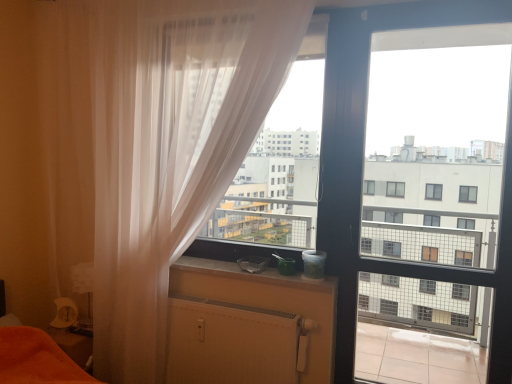
Question: Is white matte radiator at lower center looking in the opposite direction of smooth concrete window sill at center?

Choices:
 (A) no
 (B) yes

Answer: (A)

Question: Does white matte radiator at lower center have a lesser width compared to smooth concrete window sill at center?

Choices:
 (A) yes
 (B) no

Answer: (A)

Question: Is white matte radiator at lower center far from smooth concrete window sill at center?

Choices:
 (A) yes
 (B) no

Answer: (B)

Question: Is white matte radiator at lower center not within smooth concrete window sill at center?

Choices:
 (A) no
 (B) yes

Answer: (B)

Question: From a real-world perspective, is white matte radiator at lower center located higher than smooth concrete window sill at center?

Choices:
 (A) no
 (B) yes

Answer: (A)

Question: Considering the positions of white matte radiator at lower center and transparent plastic window screen at center in the image, is white matte radiator at lower center taller or shorter than transparent plastic window screen at center?

Choices:
 (A) tall
 (B) short

Answer: (B)

Question: In the image, is white matte radiator at lower center on the left side or the right side of transparent plastic window screen at center?

Choices:
 (A) left
 (B) right

Answer: (A)

Question: Which is correct: white matte radiator at lower center is inside transparent plastic window screen at center, or outside of it?

Choices:
 (A) outside
 (B) inside

Answer: (A)

Question: From the image's perspective, relative to transparent plastic window screen at center, is white matte radiator at lower center above or below?

Choices:
 (A) above
 (B) below

Answer: (B)

Question: Would you say smooth concrete window sill at center is to the left or to the right of transparent glass screen door at center in the picture?

Choices:
 (A) left
 (B) right

Answer: (A)

Question: Is smooth concrete window sill at center bigger or smaller than transparent glass screen door at center?

Choices:
 (A) small
 (B) big

Answer: (A)

Question: Considering the positions of smooth concrete window sill at center and transparent glass screen door at center in the image, is smooth concrete window sill at center wider or thinner than transparent glass screen door at center?

Choices:
 (A) thin
 (B) wide

Answer: (B)

Question: From their relative heights in the image, would you say smooth concrete window sill at center is taller or shorter than transparent glass screen door at center?

Choices:
 (A) tall
 (B) short

Answer: (B)

Question: In the image, is translucent white curtain at left on the left side or the right side of smooth concrete window sill at center?

Choices:
 (A) right
 (B) left

Answer: (B)

Question: Relative to smooth concrete window sill at center, is translucent white curtain at left in front or behind?

Choices:
 (A) behind
 (B) front

Answer: (B)